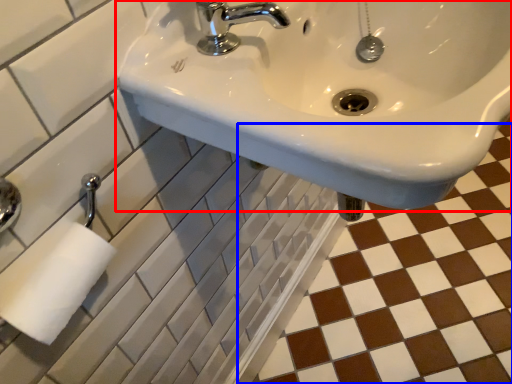
Question: Which object appears closest to the camera in this image, sink (highlighted by a red box) or ceramic tile (highlighted by a blue box)?

Choices:
 (A) sink
 (B) ceramic tile

Answer: (A)